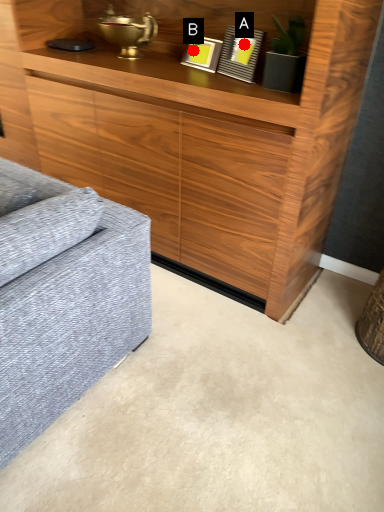
Question: Two points are circled on the image, labeled by A and B beside each circle. Which of the following is the closest to the observer?

Choices:
 (A) A is closer
 (B) B is closer

Answer: (A)